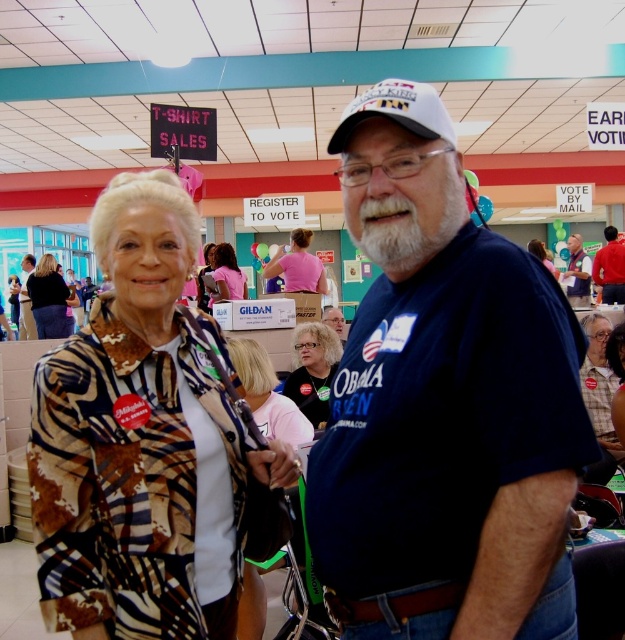
Is curly blonde hair at center bigger than pink fabric shirt at center?

Actually, curly blonde hair at center might be smaller than pink fabric shirt at center.

Between curly blonde hair at center and pink fabric shirt at center, which one is positioned higher?

pink fabric shirt at center is above.

Where is `curly blonde hair at center`? curly blonde hair at center is located at coordinates (312, 371).

Who is higher up, red shirt at center or matte black shirt at center?

matte black shirt at center

Between point (616, 259) and point (26, 266), which one is positioned in front?

Point (616, 259) is in front.

At what (x,y) coordinates should I click in order to perform the action: click on red shirt at center. Please return your answer as a coordinate pair (x, y). The height and width of the screenshot is (640, 625). Looking at the image, I should click on (610, 268).

Locate an element on the screen. The height and width of the screenshot is (640, 625). red shirt at center is located at coordinates (610, 268).

Can you confirm if blue t-shirt at center is positioned to the right of blue cotton t-shirt at center?

Indeed, blue t-shirt at center is positioned on the right side of blue cotton t-shirt at center.

Which is more to the left, blue t-shirt at center or blue cotton t-shirt at center?

Positioned to the left is blue cotton t-shirt at center.

At what (x,y) coordinates should I click in order to perform the action: click on blue t-shirt at center. Please return your answer as a coordinate pair (x, y). The width and height of the screenshot is (625, 640). Looking at the image, I should click on (578, 273).

The image size is (625, 640). I want to click on blue t-shirt at center, so click(578, 273).